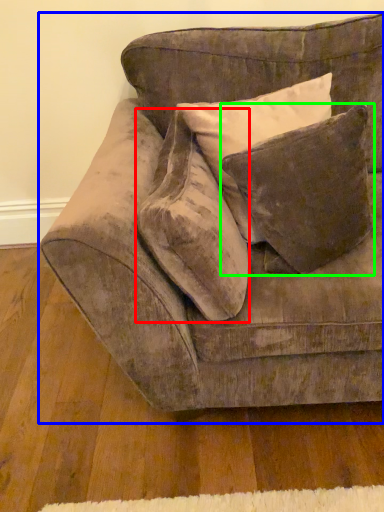
Question: Which is farther away from throw pillow (highlighted by a red box)? studio couch (highlighted by a blue box) or pillow (highlighted by a green box)?

Choices:
 (A) studio couch
 (B) pillow

Answer: (B)